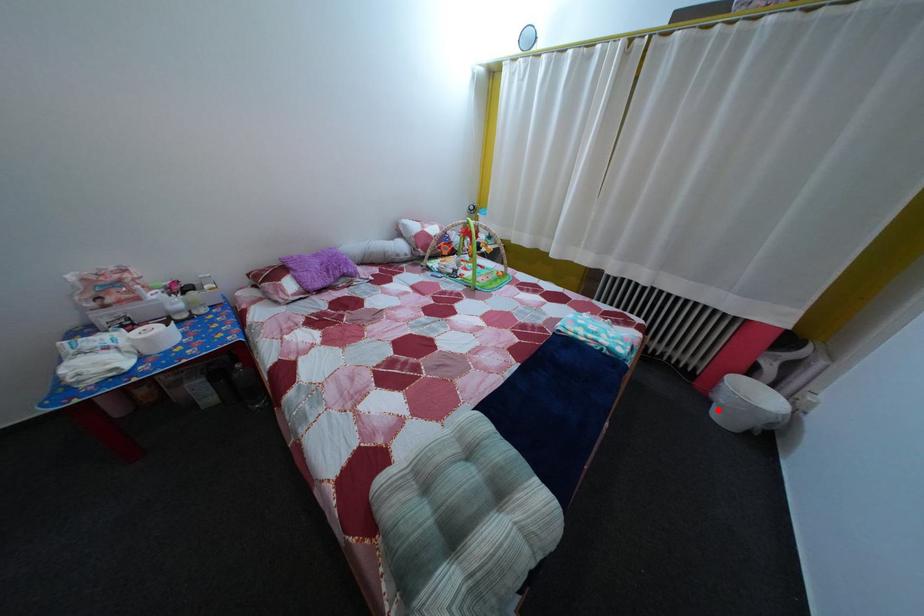
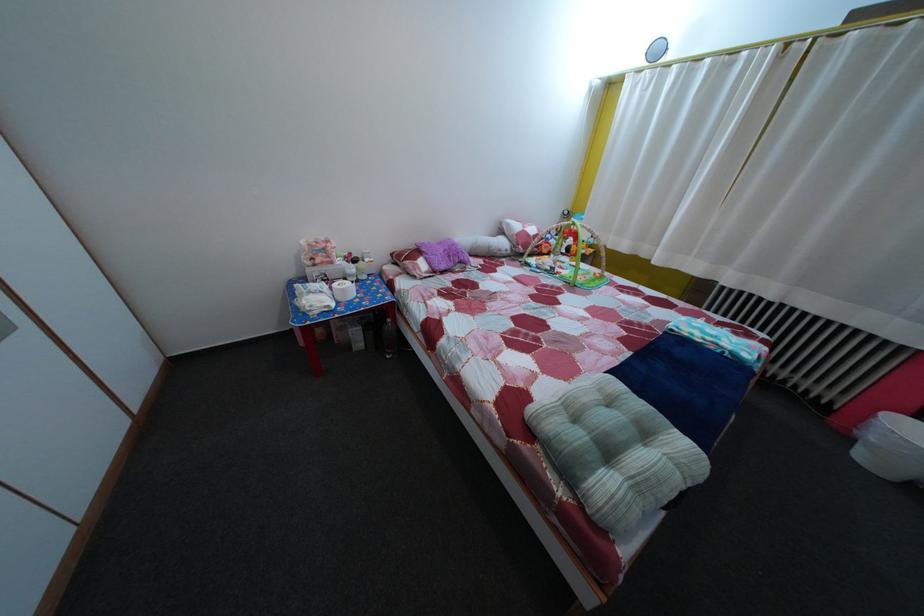
Locate, in the second image, the point that corresponds to the highlighted location in the first image.

(860, 447)